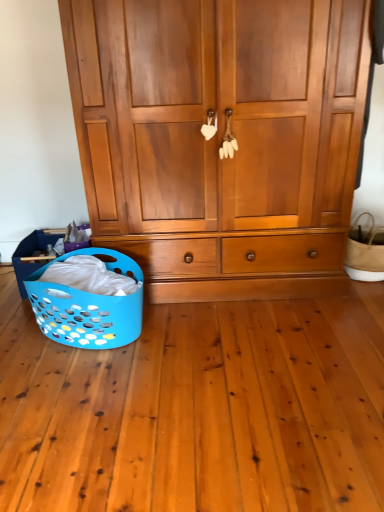
Question: Looking at their shapes, would you say wooden wardrobe at center is wider or thinner than natural woven basket at right, arranged as the 1th basket when viewed from the right?

Choices:
 (A) thin
 (B) wide

Answer: (B)

Question: Based on their sizes in the image, would you say wooden wardrobe at center is bigger or smaller than natural woven basket at right, acting as the second basket starting from the left?

Choices:
 (A) small
 (B) big

Answer: (B)

Question: Which is nearer to the blue plastic laundry basket at lower left, the 1th basket when ordered from left to right?

Choices:
 (A) wooden wardrobe at center
 (B) natural woven basket at right, acting as the second basket starting from the left

Answer: (A)

Question: Estimate the real-world distances between objects in this image. Which object is farther from the natural woven basket at right, arranged as the 1th basket when viewed from the right?

Choices:
 (A) blue plastic laundry basket at lower left, placed as the 2th basket when sorted from right to left
 (B) wooden wardrobe at center

Answer: (A)